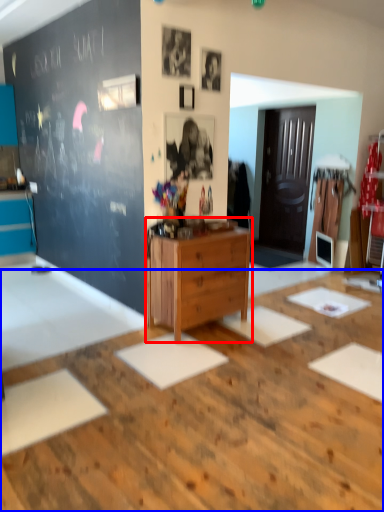
Question: Which point is closer to the camera, chest of drawers (highlighted by a red box) or table (highlighted by a blue box)?

Choices:
 (A) chest of drawers
 (B) table

Answer: (B)